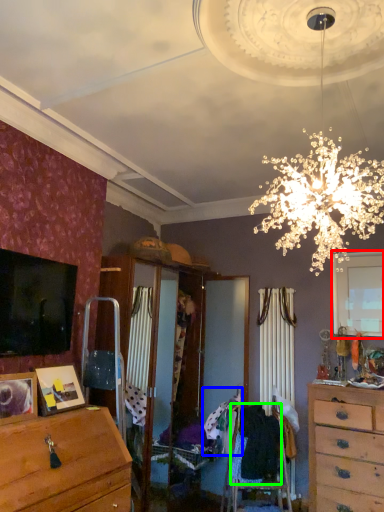
Question: Based on their relative distances, which object is nearer to window (highlighted by a red box)? Choose from clothing (highlighted by a blue box) and clothing (highlighted by a green box).

Choices:
 (A) clothing
 (B) clothing

Answer: (B)